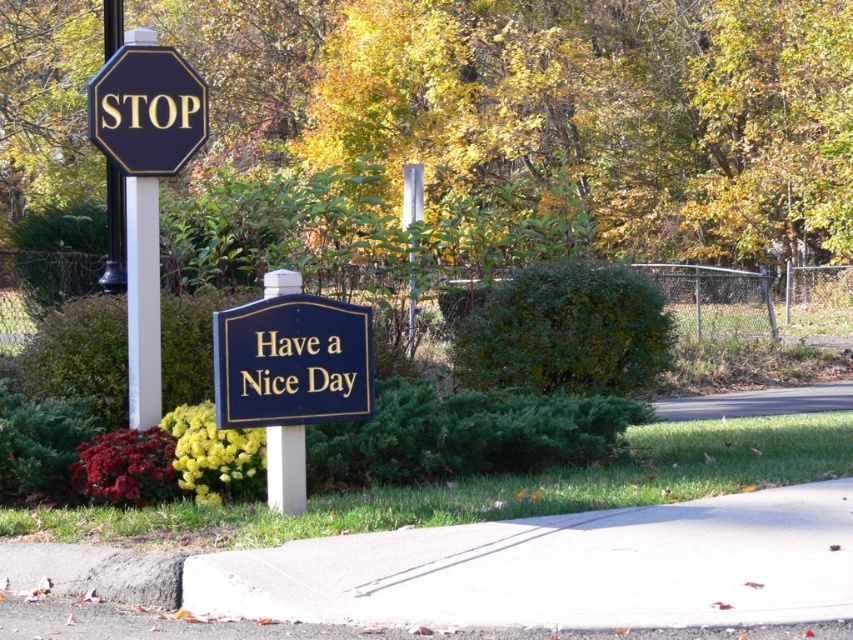
You are a delivery driver approaching the suburban area shown. You need to know if the glossy blue sign at center can fit through a narrow alley that only allows items thinner than the black metal pole at left. Can it pass through?

The glossy blue sign at center is thinner than the black metal pole at left, so it can pass through the narrow alley.

You are a pedestrian walking on the sidewalk and notice the glossy blue sign at center and the black metal pole at left. Which object is larger in size?

The glossy blue sign at center is smaller than the black metal pole at left, so the black metal pole at left is larger in size.